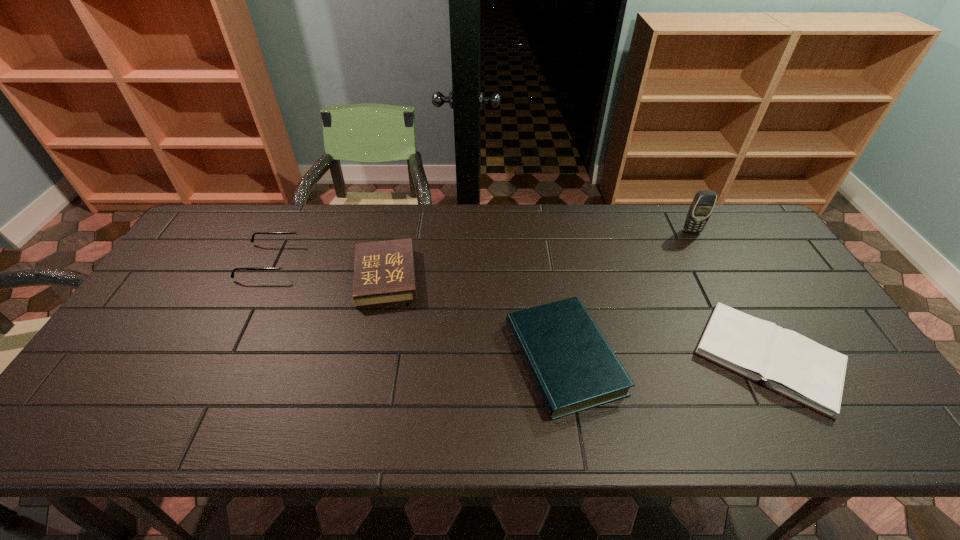
At what (x,y) coordinates should I click in order to perform the action: click on vacant space located on the left of the third object from left to right. Please return your answer as a coordinate pair (x, y). Looking at the image, I should click on (419, 358).

The height and width of the screenshot is (540, 960). I want to click on vacant space positioned 0.210m on the back of the shortest object, so click(711, 255).

The image size is (960, 540). Find the location of `cellular telephone present at the far edge`. cellular telephone present at the far edge is located at coordinates (703, 203).

This screenshot has height=540, width=960. I want to click on spectacles that is at the far edge, so click(286, 266).

Identify the location of hardback book that is at the far edge. This screenshot has width=960, height=540. (384, 272).

Identify the location of object positioned at the right edge. (789, 364).

You are a GUI agent. You are given a task and a screenshot of the screen. Output one action in this format:
    pyautogui.click(x=<x>, y=<y>)
    Task: Click on the object that is at the near right corner
    Image resolution: width=960 pixels, height=540 pixels.
    Given the screenshot: What is the action you would take?
    pyautogui.click(x=789, y=364)

Identify the location of vacant point at the far edge. (500, 235).

In the image, there is a desktop. Where is `vacant area at the near edge`? The height and width of the screenshot is (540, 960). vacant area at the near edge is located at coordinates (824, 438).

In the image, there is a desktop. Identify the location of vacant space at the left edge. This screenshot has width=960, height=540. (151, 319).